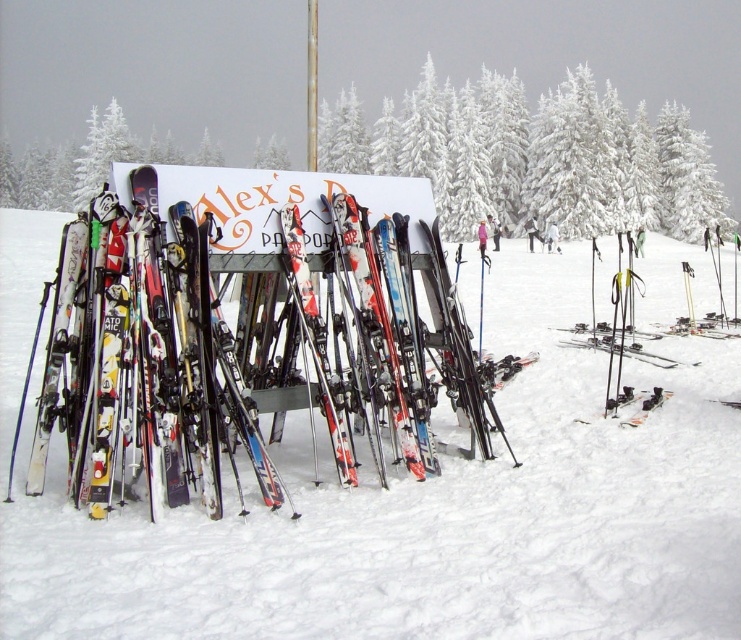
Question: Is multicolored plastic skis at center positioned at the back of white snow-covered tree at center?

Choices:
 (A) yes
 (B) no

Answer: (B)

Question: Which point is closer to the camera?

Choices:
 (A) multicolored plastic skis at center
 (B) white matte snow at center
 (C) white snow-covered tree at center

Answer: (B)

Question: Does white matte snow at center have a greater width compared to multicolored plastic skis at center?

Choices:
 (A) no
 (B) yes

Answer: (B)

Question: Considering the relative positions of white matte snow at center and white snow-covered tree at center in the image provided, where is white matte snow at center located with respect to white snow-covered tree at center?

Choices:
 (A) left
 (B) right

Answer: (B)

Question: Among these points, which one is nearest to the camera?

Choices:
 (A) (441, 125)
 (B) (285, 296)
 (C) (657, 280)
 (D) (657, 401)

Answer: (B)

Question: Which point is farther to the camera?

Choices:
 (A) matte black ski at lower right
 (B) white matte snow at center
 (C) white snow-covered tree at center
 (D) multicolored plastic skis at center

Answer: (C)